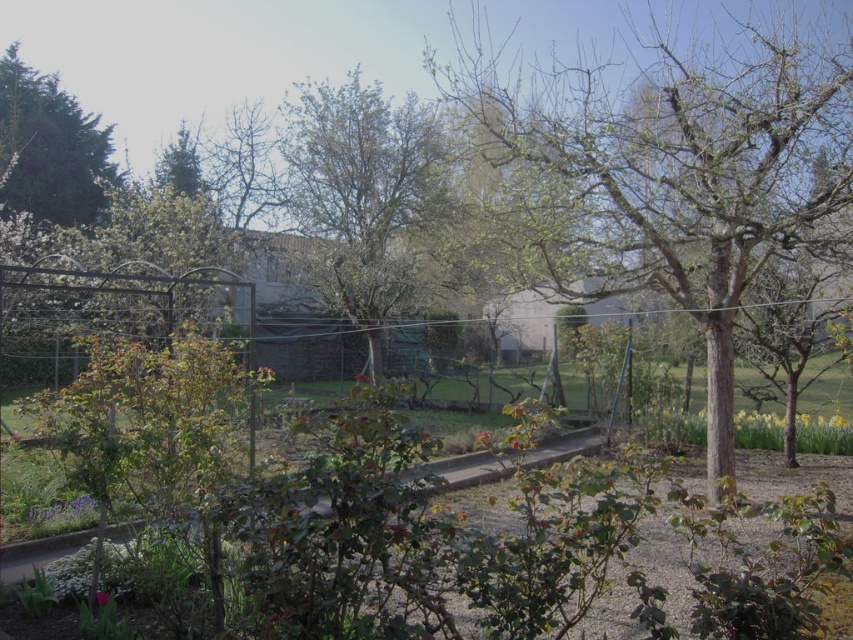
You are standing at the entrance of the garden and want to find the smooth bark tree at center. According to the coordinates provided, in which general direction should you walk to reach it?

The smooth bark tree at center is located at coordinates point (666, 176). Since the coordinate system typically places (0, 0) at the bottom left corner, the tree is positioned to the right and slightly above the lower part of the image. Therefore, you should walk towards the center of the garden, slightly to the right from the entrance to reach it.

You are standing at the entrance of the garden and want to find the green leafy tree at center. According to the coordinates provided, in which direction should you walk to reach it?

The green leafy tree at center is located at coordinates 0.311 on the x axis and 0.431 on the y axis. Since you are at the entrance, which is likely at the bottom left corner of the image, you should walk diagonally towards the upper right direction to reach the green leafy tree at center.